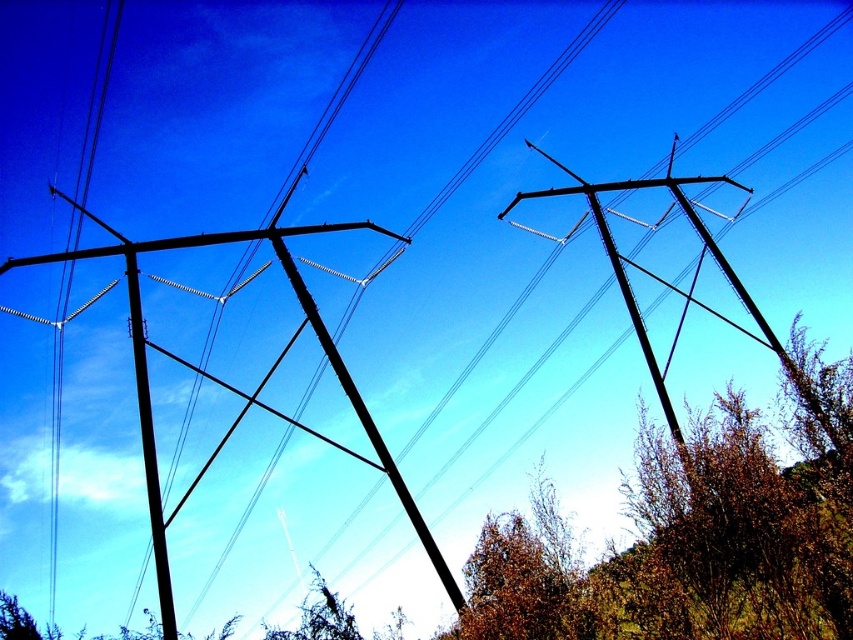
You are a bird looking for a perch. You see a brown leafy tree at lower right and a smooth black telegraph pole at center. Which one is taller and better for a high vantage point?

The smooth black telegraph pole at center is taller than the brown leafy tree at lower right, so it provides a better high vantage point.

You are planning to install a new sensor on the black metallic telegraph pole at left. Given its location at point coordinates, can you determine if it is positioned on the left side of the image?

The black metallic telegraph pole at left is located at point coordinates, so yes, it is positioned on the left side of the image as its x coordinate is 0.605 which is less than 0.5 indicating left side.